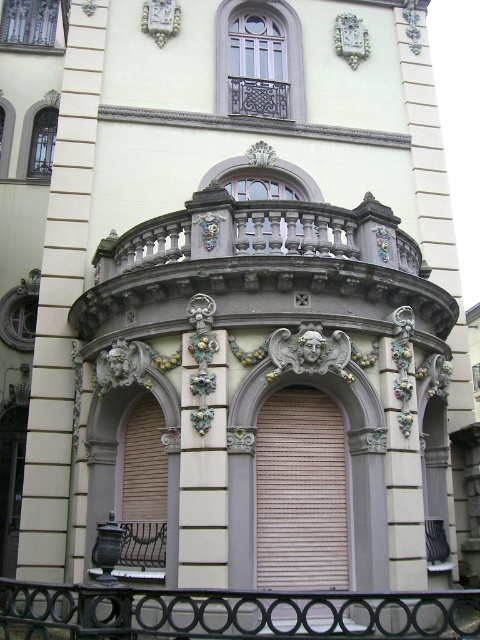
Between point (104, 19) and point (408, 467), which one is positioned in front?

Point (408, 467)

Consider the image. Who is more forward, (x=27, y=554) or (x=420, y=561)?

Point (x=420, y=561) is in front.

I want to click on white stone column at center, so click(x=62, y=284).

Is carved stone balcony at center above black wrought iron railing at lower center?

Indeed, carved stone balcony at center is positioned over black wrought iron railing at lower center.

Is carved stone balcony at center positioned behind black wrought iron railing at lower center?

Yes, carved stone balcony at center is further from the viewer.

Image resolution: width=480 pixels, height=640 pixels. Describe the element at coordinates (261, 268) in the screenshot. I see `carved stone balcony at center` at that location.

The height and width of the screenshot is (640, 480). What are the coordinates of `carved stone balcony at center` in the screenshot? It's located at (261, 268).

Can you confirm if black wrought iron railing at lower center is taller than white glossy pillar at center?

Incorrect, black wrought iron railing at lower center's height is not larger of white glossy pillar at center's.

Locate an element on the screen. The height and width of the screenshot is (640, 480). black wrought iron railing at lower center is located at coordinates (228, 612).